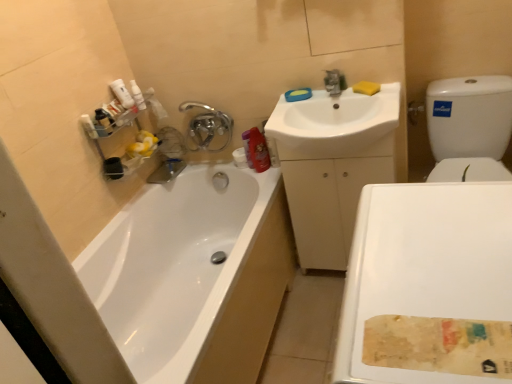
What is the approximate width of white glossy toilet at right?

white glossy toilet at right is 18.26 inches wide.

Describe the element at coordinates (122, 94) in the screenshot. The width and height of the screenshot is (512, 384). I see `white matte bottles at upper left, the 2th cleaning product from the right` at that location.

Locate an element on the screen. The image size is (512, 384). silver metallic faucet at upper center is located at coordinates (208, 126).

From the picture: Measure the distance from white glossy toilet at right to matte plastic mouthwash at upper left.

white glossy toilet at right is 4.38 feet from matte plastic mouthwash at upper left.

Does white glossy toilet at right have a greater height compared to matte plastic mouthwash at upper left?

Correct, white glossy toilet at right is much taller as matte plastic mouthwash at upper left.

From the image's perspective, is white glossy toilet at right located above or below matte plastic mouthwash at upper left?

Based on their image positions, white glossy toilet at right is located beneath matte plastic mouthwash at upper left.

Is point (357, 232) in front of point (105, 122)?

Yes, it is.

From a real-world perspective, is matte red bottle at upper right, the second cleaning product positioned from the top, above or below white glossy bathtub at left?

From a real-world perspective, matte red bottle at upper right, the second cleaning product positioned from the top, is physically above white glossy bathtub at left.

Is the depth of matte red bottle at upper right, marked as the 1th cleaning product in a right-to-left arrangement, greater than that of white glossy bathtub at left?

Yes, matte red bottle at upper right, marked as the 1th cleaning product in a right-to-left arrangement, is further from the camera.

How different are the orientations of matte red bottle at upper right, the second cleaning product positioned from the top, and white glossy bathtub at left in degrees?

They differ by 120 degrees in their facing directions.

At what (x,y) coordinates should I click in order to perform the action: click on cleaning product located on the right of white glossy bathtub at left. Please return your answer as a coordinate pair (x, y). The height and width of the screenshot is (384, 512). Looking at the image, I should click on (257, 151).

This screenshot has height=384, width=512. I want to click on bathtub below the white glossy sink at upper center (from the image's perspective), so click(193, 276).

Which object is closer to the camera, white glossy sink at upper center or white glossy bathtub at left?

white glossy bathtub at left.

Can you confirm if white glossy sink at upper center is smaller than white glossy bathtub at left?

Yes, white glossy sink at upper center is smaller than white glossy bathtub at left.

Consider the image. In terms of height, does white glossy sink at upper center look taller or shorter compared to white glossy bathtub at left?

Clearly, white glossy sink at upper center is shorter compared to white glossy bathtub at left.

From a real-world perspective, is silver metallic faucet at upper center positioned above or below matte plastic mouthwash at upper left?

From a real-world perspective, silver metallic faucet at upper center is physically below matte plastic mouthwash at upper left.

Between silver metallic faucet at upper center and matte plastic mouthwash at upper left, which one has larger width?

silver metallic faucet at upper center is wider.

Consider the image. From the image's perspective, is silver metallic faucet at upper center located beneath matte plastic mouthwash at upper left?

Incorrect, from the image's perspective, silver metallic faucet at upper center is higher than matte plastic mouthwash at upper left.

Are silver metallic faucet at upper center and matte plastic mouthwash at upper left far apart?

That's not correct — silver metallic faucet at upper center is a little close to matte plastic mouthwash at upper left.

Consider the image. From the image's perspective, is yellow sponge at upper center positioned above or below white matte bottles at upper left, the 2th cleaning product from the right?

Clearly, from the image's perspective, yellow sponge at upper center is below white matte bottles at upper left, the 2th cleaning product from the right.

Based on the photo, is yellow sponge at upper center turned away from white matte bottles at upper left, the first cleaning product positioned from the top?

yellow sponge at upper center is not turned away from white matte bottles at upper left, the first cleaning product positioned from the top.

Considering the relative positions of yellow sponge at upper center and white matte bottles at upper left, the 2th cleaning product from the right, in the image provided, is yellow sponge at upper center to the left or to the right of white matte bottles at upper left, the 2th cleaning product from the right,?

In the image, yellow sponge at upper center appears on the right side of white matte bottles at upper left, the 2th cleaning product from the right.

Is white glossy sink at upper center beside white glossy toilet at right?

white glossy sink at upper center and white glossy toilet at right are clearly separated.

Considering the relative sizes of white glossy sink at upper center and white glossy toilet at right in the image provided, is white glossy sink at upper center taller than white glossy toilet at right?

Incorrect, the height of white glossy sink at upper center is not larger of that of white glossy toilet at right.

From the image's perspective, is white glossy sink at upper center over white glossy toilet at right?

Yes, from the image's perspective, white glossy sink at upper center is on top of white glossy toilet at right.

Considering the relative sizes of white glossy sink at upper center and white glossy toilet at right in the image provided, is white glossy sink at upper center bigger than white glossy toilet at right?

Actually, white glossy sink at upper center might be smaller than white glossy toilet at right.

Does silver metallic faucet at upper center have a lesser width compared to white matte bottles at upper left, the 2th cleaning product from the right?

No.

Is silver metallic faucet at upper center placed right next to white matte bottles at upper left, positioned as the second cleaning product in bottom-to-top order?

No, silver metallic faucet at upper center is not touching white matte bottles at upper left, positioned as the second cleaning product in bottom-to-top order.

Looking at this image, measure the distance from silver metallic faucet at upper center to white matte bottles at upper left, the first cleaning product from the left.

silver metallic faucet at upper center and white matte bottles at upper left, the first cleaning product from the left, are 13.62 inches apart from each other.

The height and width of the screenshot is (384, 512). I want to click on tap below the white matte bottles at upper left, the first cleaning product positioned from the top (from a real-world perspective), so click(208, 126).

This screenshot has width=512, height=384. Find the location of `mouthwash above the white glossy toilet at right (from a real-world perspective)`. mouthwash above the white glossy toilet at right (from a real-world perspective) is located at coordinates (104, 120).

Where is `bathtub located in front of the matte red bottle at upper right, the second cleaning product positioned from the top`? bathtub located in front of the matte red bottle at upper right, the second cleaning product positioned from the top is located at coordinates (193, 276).

Which object lies nearer to the anchor point matte red bottle at upper right, marked as the 1th cleaning product in a right-to-left arrangement, matte plastic mouthwash at upper left or white glossy sink at upper center?

Based on the image, white glossy sink at upper center appears to be nearer to matte red bottle at upper right, marked as the 1th cleaning product in a right-to-left arrangement.

From the image, which object appears to be farther from white glossy bathtub at left, silver metallic faucet at upper center or yellow sponge at upper center?

yellow sponge at upper center is further to white glossy bathtub at left.

Looking at this image, looking at the image, which one is located closer to matte plastic mouthwash at upper left, white glossy toilet at right or white glossy bathtub at left?

Among the two, white glossy bathtub at left is located nearer to matte plastic mouthwash at upper left.

Estimate the real-world distances between objects in this image. Which object is further from white glossy bathtub at left, white glossy toilet at right or matte plastic mouthwash at upper left?

white glossy toilet at right is further to white glossy bathtub at left.

Which object lies nearer to the anchor point white glossy toilet at right, matte plastic mouthwash at upper left or white glossy sink at upper center?

white glossy sink at upper center lies closer to white glossy toilet at right than the other object.

Looking at the image, which one is located closer to white glossy sink at upper center, yellow sponge at upper center or white glossy toilet at right?

The object closer to white glossy sink at upper center is yellow sponge at upper center.

Looking at the image, which one is located closer to silver metallic faucet at upper center, white glossy sink at upper center or matte plastic mouthwash at upper left?

Among the two, matte plastic mouthwash at upper left is located nearer to silver metallic faucet at upper center.

When comparing their distances from silver metallic faucet at upper center, does white matte bottles at upper left, positioned as the second cleaning product in bottom-to-top order, or matte plastic mouthwash at upper left seem further?

The object further to silver metallic faucet at upper center is matte plastic mouthwash at upper left.

Identify the location of mouthwash between white glossy toilet at right and matte red bottle at upper right, the second cleaning product in the left-to-right sequence, in the front-back direction. The height and width of the screenshot is (384, 512). (104, 120).

The image size is (512, 384). In order to click on sink between white glossy toilet at right and matte red bottle at upper right, the second cleaning product positioned from the top, along the z-axis in this screenshot , I will do `click(336, 125)`.

Where is `cleaning product between yellow sponge at upper center and white glossy bathtub at left vertically`? The height and width of the screenshot is (384, 512). cleaning product between yellow sponge at upper center and white glossy bathtub at left vertically is located at coordinates (257, 151).

Where is `mouthwash between white glossy bathtub at left and silver metallic faucet at upper center along the z-axis`? mouthwash between white glossy bathtub at left and silver metallic faucet at upper center along the z-axis is located at coordinates (104, 120).